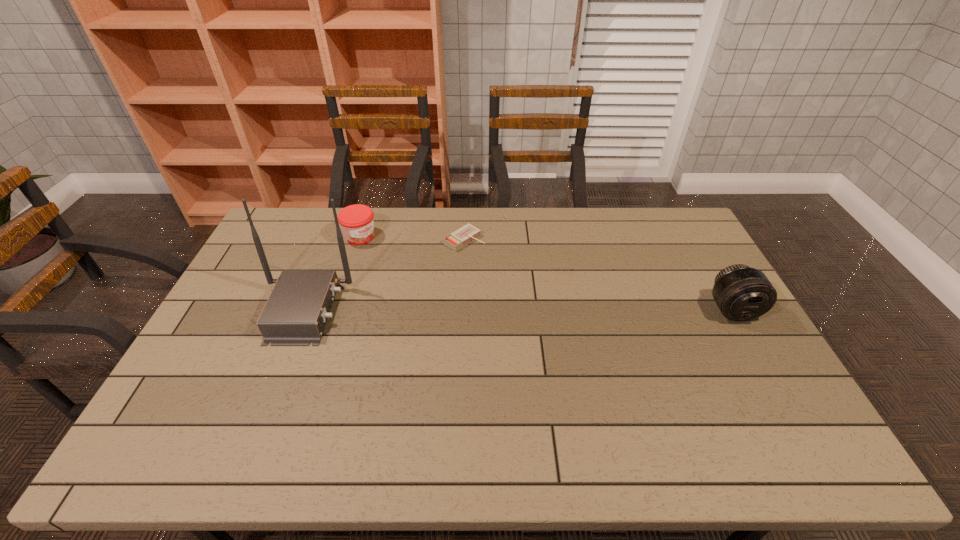
I want to click on vacant spot on the desktop that is between the tallest object and the second tallest object and is positioned on the label side of the jam, so pos(467,310).

This screenshot has width=960, height=540. In order to click on vacant space on the desktop that is between the tallest object and the rightmost object and is positioned on the striking surface of the matchbox in this screenshot , I will do `click(576, 309)`.